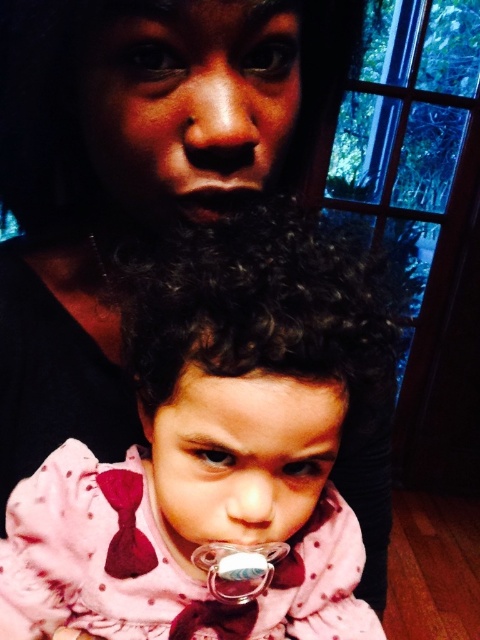
Question: Can you confirm if clear plastic pacifier at center is thinner than dry matte lips at center?

Choices:
 (A) yes
 (B) no

Answer: (A)

Question: Which object is positioned closest to the clear plastic pacifier at center?

Choices:
 (A) pink fabric pacifier at center
 (B) dry matte lips at center

Answer: (A)

Question: From the image, what is the correct spatial relationship of clear plastic pacifier at center in relation to dry matte lips at center?

Choices:
 (A) above
 (B) below

Answer: (B)

Question: Can you confirm if pink fabric pacifier at center is positioned to the left of dry matte lips at center?

Choices:
 (A) yes
 (B) no

Answer: (B)

Question: Estimate the real-world distances between objects in this image. Which object is farther from the dry matte lips at center?

Choices:
 (A) pink fabric pacifier at center
 (B) clear plastic pacifier at center

Answer: (B)

Question: Which point is farther to the camera?

Choices:
 (A) (141, 625)
 (B) (236, 563)
 (C) (204, 188)

Answer: (A)